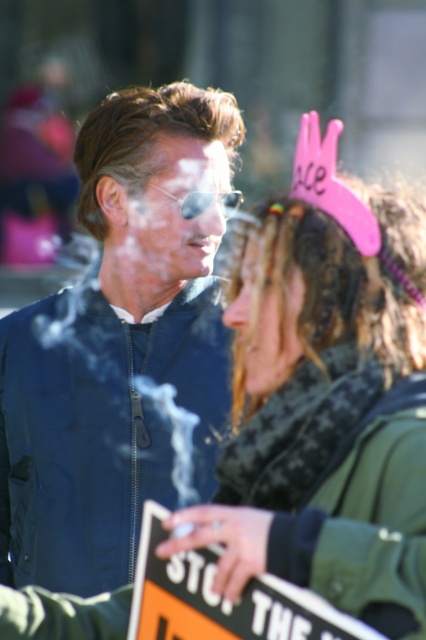
You are a photographer trying to capture a closeup of the green textured scarf at center and the brown shiny hair at upper center. Which object should you focus on first to ensure it appears sharp in the photo?

The green textured scarf at center should be focused on first because it is closer to the viewer than the brown shiny hair at upper center.

You are standing in the crowd at the protest and see the point marked at coordinates (118, 344). What object is this point located on?

The point at coordinates (118, 344) is located on the matte blue jacket at center.